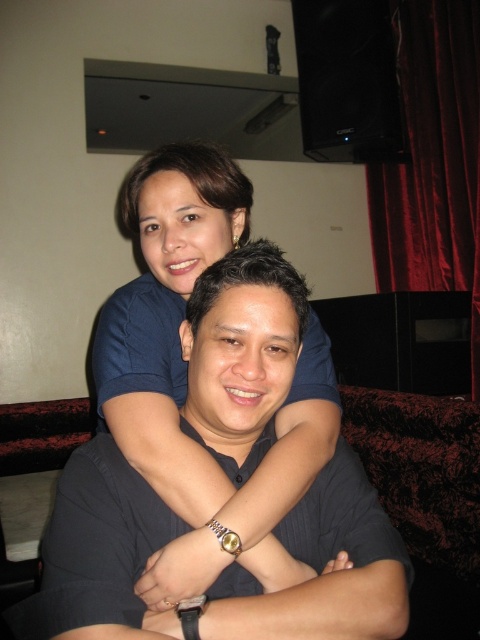
Question: In this image, where is blue smooth shirt at upper center located relative to velvet red curtain at upper right?

Choices:
 (A) left
 (B) right

Answer: (A)

Question: Which object appears farthest from the camera in this image?

Choices:
 (A) blue smooth shirt at upper center
 (B) velvet red curtain at upper right

Answer: (B)

Question: From the image, what is the correct spatial relationship of blue smooth shirt at upper center in relation to velvet red curtain at upper right?

Choices:
 (A) below
 (B) above

Answer: (A)

Question: Which object appears farthest from the camera in this image?

Choices:
 (A) velvet red curtain at upper right
 (B) blue smooth shirt at upper center

Answer: (A)

Question: Does blue smooth shirt at upper center lie in front of velvet red curtain at upper right?

Choices:
 (A) no
 (B) yes

Answer: (B)

Question: Which of the following is the closest to the observer?

Choices:
 (A) (476, 179)
 (B) (165, 388)

Answer: (B)